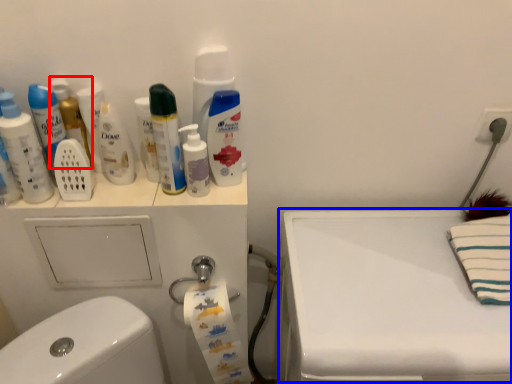
Question: Which point is closer to the camera, mouthwash (highlighted by a red box) or counter top (highlighted by a blue box)?

Choices:
 (A) mouthwash
 (B) counter top

Answer: (B)